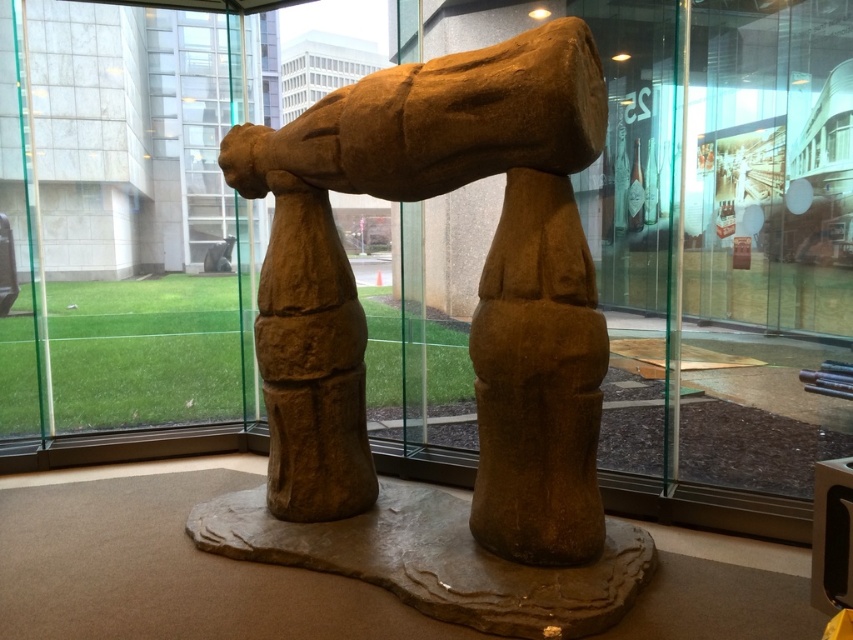
You are an art curator planning to move the brown stone sculpture at center into a new exhibition space. The entrance to the new space has a height restriction of 2 meters. Can the sculpture pass through the transparent glass door at upper left based on its height compared to the door?

The brown stone sculpture at center is not as tall as the transparent glass door at upper left, so it can pass through the door as long as its height is under 2 meters. However, the exact height of the sculpture and door must be confirmed to ensure compliance with the 2 meter restriction.

You are standing in front of the glass enclosure and want to take a photo of the brown stone sculpture at center. If the camera is positioned at point A, which is directly in front of the sculpture, would the sculpture be centered in the photo?

The brown stone sculpture at center is located at point coordinates that are slightly offset from the exact center of the image. Therefore, positioning the camera directly in front of the sculpture at point A would still likely center it in the photo, as the coordinates are close to the center.

Based on the photo, you are an art curator planning to move the brown stone sculpture at center through the transparent glass door at upper left. Based on their sizes, can the sculpture fit through the door horizontally?

The brown stone sculpture at center is wider than the transparent glass door at upper left, so it cannot fit through the door horizontally.